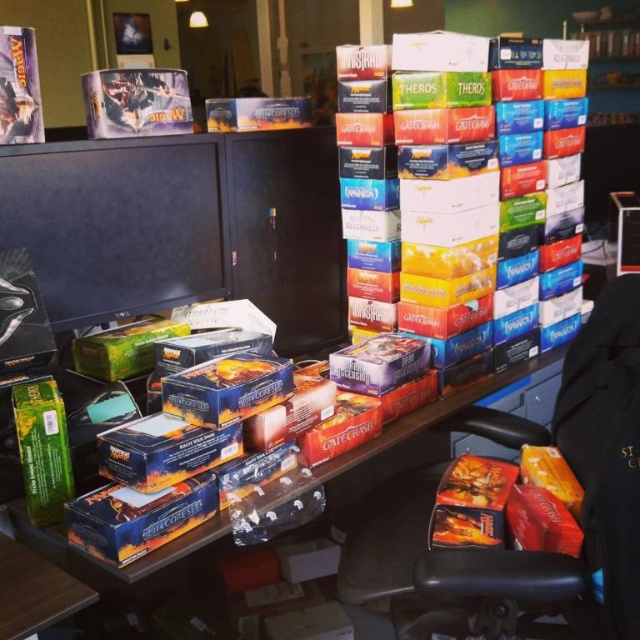
Which is more to the left, black plastic swivel chair at lower right or matte cardboard boxes at center?

matte cardboard boxes at center is more to the left.

Who is higher up, black plastic swivel chair at lower right or matte cardboard boxes at center?

matte cardboard boxes at center is higher up.

Does point (584, 563) come closer to viewer compared to point (244, 486)?

Yes, point (584, 563) is in front of point (244, 486).

What are the coordinates of `black plastic swivel chair at lower right` in the screenshot? It's located at (513, 548).